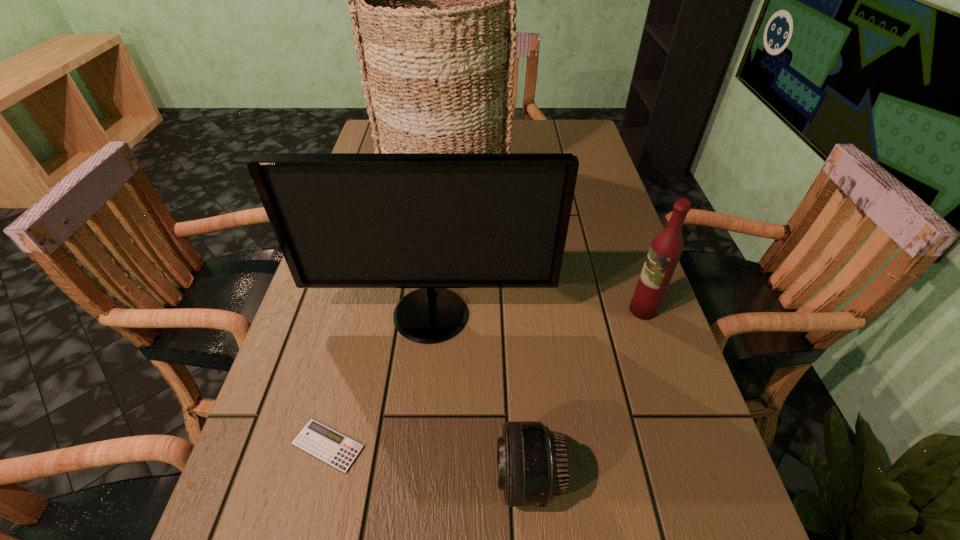
Where is `object located in the right edge section of the desktop`? This screenshot has width=960, height=540. object located in the right edge section of the desktop is located at coordinates (666, 248).

At what (x,y) coordinates should I click in order to perform the action: click on object positioned at the far left corner. Please return your answer as a coordinate pair (x, y). The height and width of the screenshot is (540, 960). Looking at the image, I should click on (433, 0).

This screenshot has width=960, height=540. Find the location of `vacant region at the far edge`. vacant region at the far edge is located at coordinates (542, 128).

Identify the location of vacant space at the right edge of the desktop. The height and width of the screenshot is (540, 960). (641, 495).

Image resolution: width=960 pixels, height=540 pixels. Identify the location of free space at the far right corner of the desktop. (589, 148).

This screenshot has width=960, height=540. Identify the location of unoccupied position between the farthest object and the telephoto lens. (487, 326).

You are a GUI agent. You are given a task and a screenshot of the screen. Output one action in this format:
    pyautogui.click(x=<x>, y=<y>)
    Task: Click on the free point between the rightmost object and the fourth tallest object
    This screenshot has height=540, width=960.
    Given the screenshot: What is the action you would take?
    pyautogui.click(x=586, y=394)

I want to click on free space between the telephoto lens and the fourth shortest object, so click(x=480, y=397).

What are the coordinates of `vacant area that lies between the liquor and the computer monitor` in the screenshot? It's located at [537, 313].

Where is `vacant area between the shortest object and the computer monitor`? This screenshot has width=960, height=540. vacant area between the shortest object and the computer monitor is located at coordinates (379, 380).